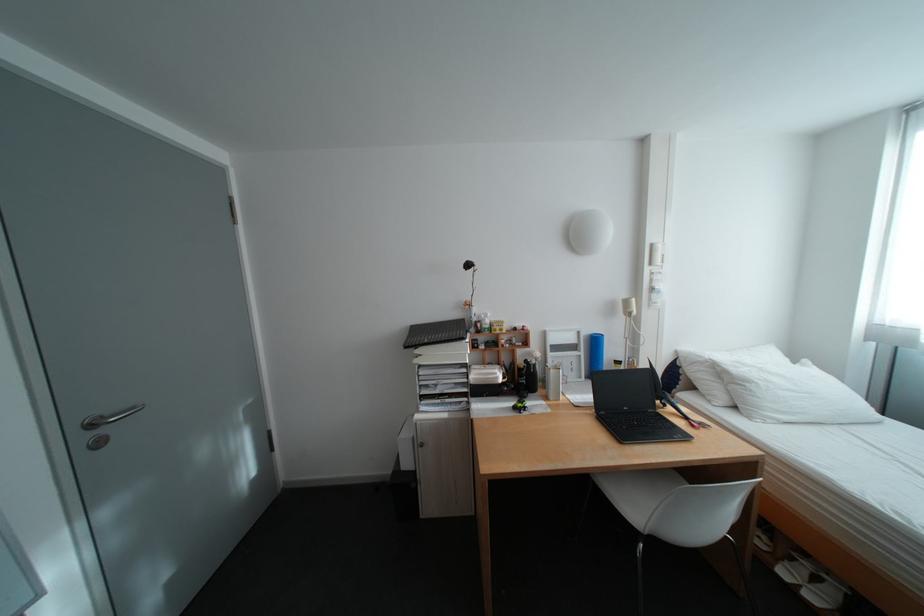
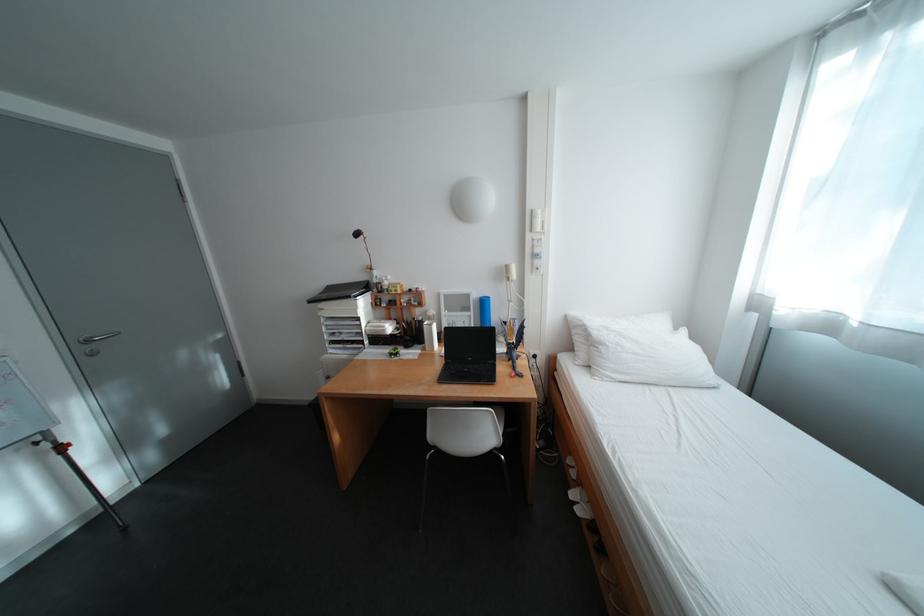
In the second image, find the point that corresponds to point (106, 426) in the first image.

(100, 342)